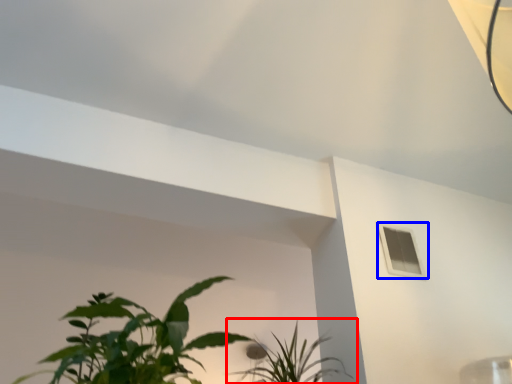
Question: Which object is closer to the camera taking this photo, houseplant (highlighted by a red box) or window (highlighted by a blue box)?

Choices:
 (A) houseplant
 (B) window

Answer: (A)